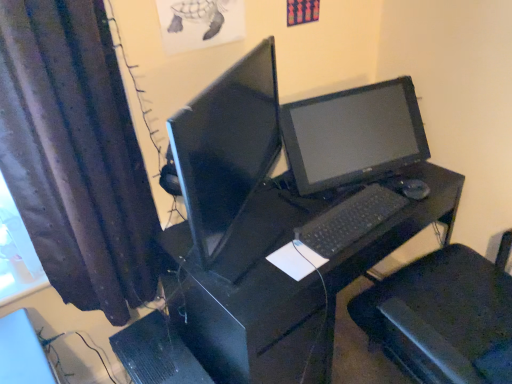
Identify the location of vacant area in front of white paper at center. The height and width of the screenshot is (384, 512). (274, 290).